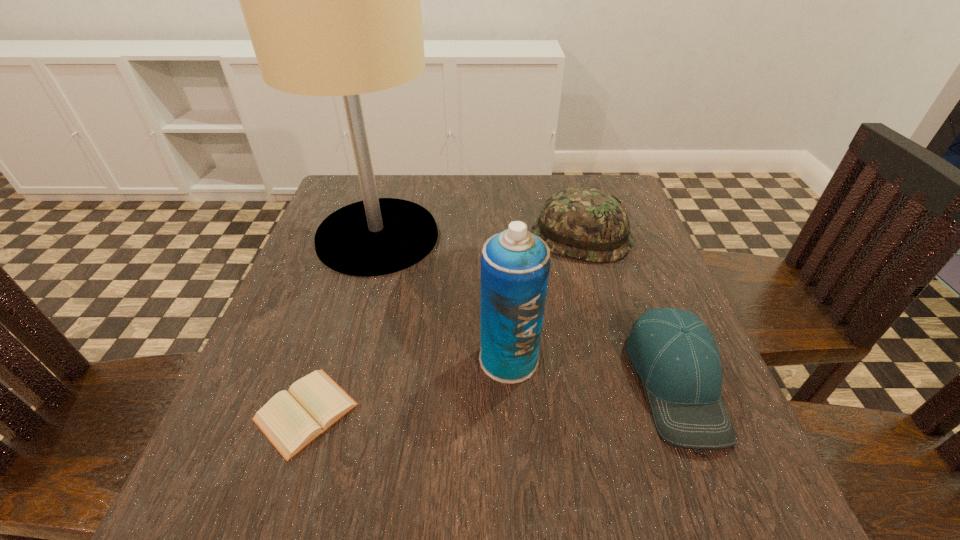
Find the location of a particular element. The image size is (960, 540). object located at the far right corner is located at coordinates (584, 223).

Locate an element on the screen. vacant region at the far edge of the desktop is located at coordinates (512, 212).

Identify the location of free spot at the near edge of the desktop. Image resolution: width=960 pixels, height=540 pixels. (453, 480).

You are a GUI agent. You are given a task and a screenshot of the screen. Output one action in this format:
    pyautogui.click(x=<x>, y=<y>)
    Task: Click on the free space at the left edge of the desktop
    
    Given the screenshot: What is the action you would take?
    click(301, 274)

Where is `vacant space at the right edge of the desktop`? vacant space at the right edge of the desktop is located at coordinates (664, 444).

Identify the location of free space at the near left corner of the desktop. Image resolution: width=960 pixels, height=540 pixels. (248, 484).

This screenshot has height=540, width=960. What are the coordinates of `unoccupied area between the tallest object and the third tallest object` in the screenshot? It's located at [479, 237].

Find the location of a particular element. free spot between the shortest object and the third tallest object is located at coordinates (444, 324).

I want to click on free space between the fourth tallest object and the shortest object, so click(491, 396).

You are a GUI agent. You are given a task and a screenshot of the screen. Output one action in this format:
    pyautogui.click(x=<x>, y=<y>)
    Task: Click on the free point between the aerosol can and the baseball cap
    This screenshot has height=540, width=960.
    Given the screenshot: What is the action you would take?
    pyautogui.click(x=592, y=370)